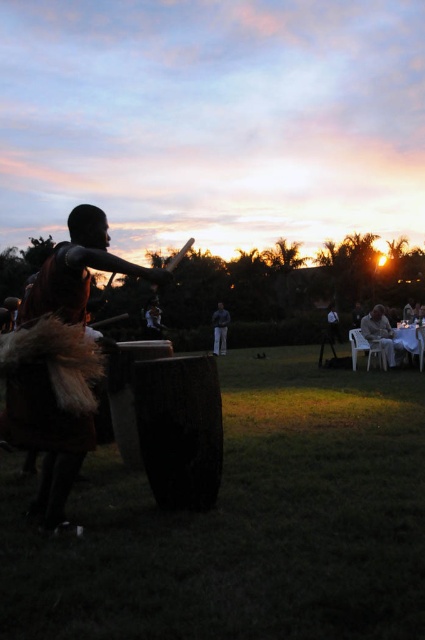
Question: Which object is the farthest from the white plastic chair at right?

Choices:
 (A) brown fur vest at left
 (B) dark gray fabric pants at center

Answer: (A)

Question: Does white plastic chair at right appear on the right side of dark gray fabric pants at center?

Choices:
 (A) no
 (B) yes

Answer: (B)

Question: Can you confirm if brown fur vest at left is smaller than dark gray fabric pants at center?

Choices:
 (A) no
 (B) yes

Answer: (A)

Question: Which of the following is the closest to the observer?

Choices:
 (A) (365, 316)
 (B) (28, 442)

Answer: (B)

Question: Does brown fur vest at left appear under white plastic chair at right?

Choices:
 (A) yes
 (B) no

Answer: (B)

Question: Which point is farther from the camera taking this photo?

Choices:
 (A) (215, 333)
 (B) (65, 250)
 (C) (374, 324)

Answer: (A)